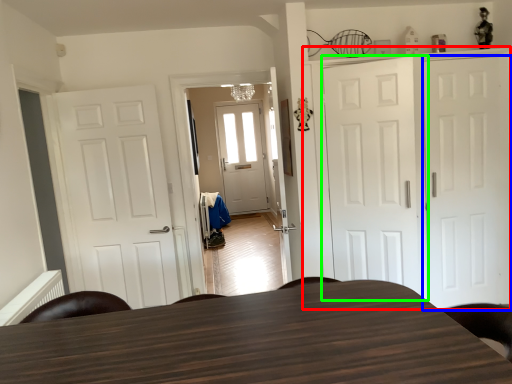
Question: Considering the real-world distances, which object is closest to cabinetry (highlighted by a red box)? door (highlighted by a blue box) or door (highlighted by a green box).

Choices:
 (A) door
 (B) door

Answer: (B)